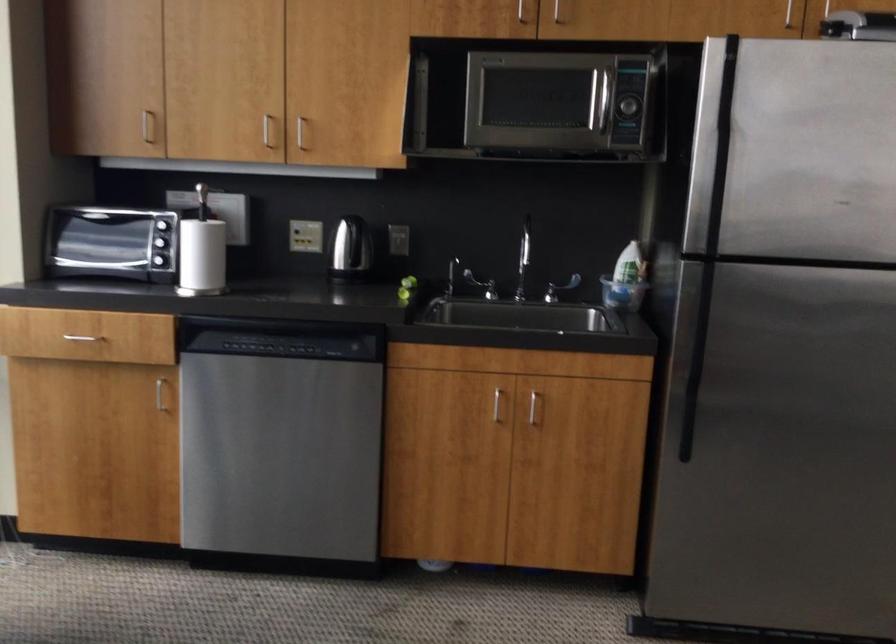
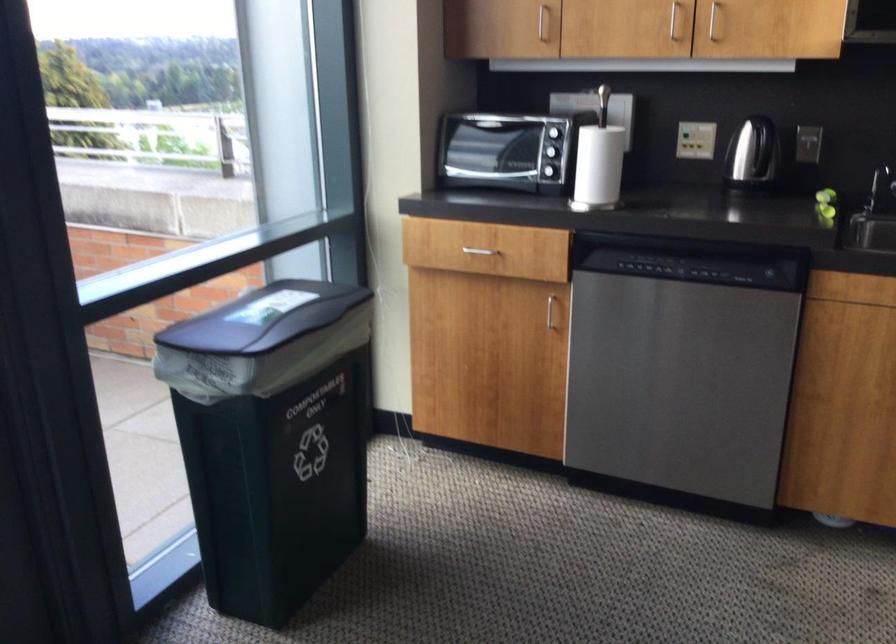
The point at (82,327) is marked in the first image. Where is the corresponding point in the second image?

(474, 241)